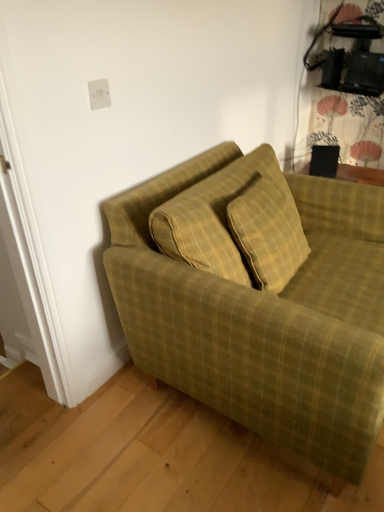
Question: From their relative heights in the image, would you say white plastic outlet at upper center is taller or shorter than green plaid fabric couch at lower right?

Choices:
 (A) tall
 (B) short

Answer: (B)

Question: Is point (105, 97) positioned closer to the camera than point (248, 321)?

Choices:
 (A) farther
 (B) closer

Answer: (A)

Question: Considering their positions, is white plastic outlet at upper center located in front of or behind green plaid fabric couch at lower right?

Choices:
 (A) front
 (B) behind

Answer: (B)

Question: Looking at their shapes, would you say green plaid fabric couch at lower right is wider or thinner than white plastic outlet at upper center?

Choices:
 (A) wide
 (B) thin

Answer: (A)

Question: Relative to white plastic outlet at upper center, is green plaid fabric couch at lower right in front or behind?

Choices:
 (A) front
 (B) behind

Answer: (A)

Question: From a real-world perspective, is green plaid fabric couch at lower right positioned above or below white plastic outlet at upper center?

Choices:
 (A) below
 (B) above

Answer: (A)

Question: Is green plaid fabric couch at lower right bigger or smaller than white plastic outlet at upper center?

Choices:
 (A) big
 (B) small

Answer: (A)